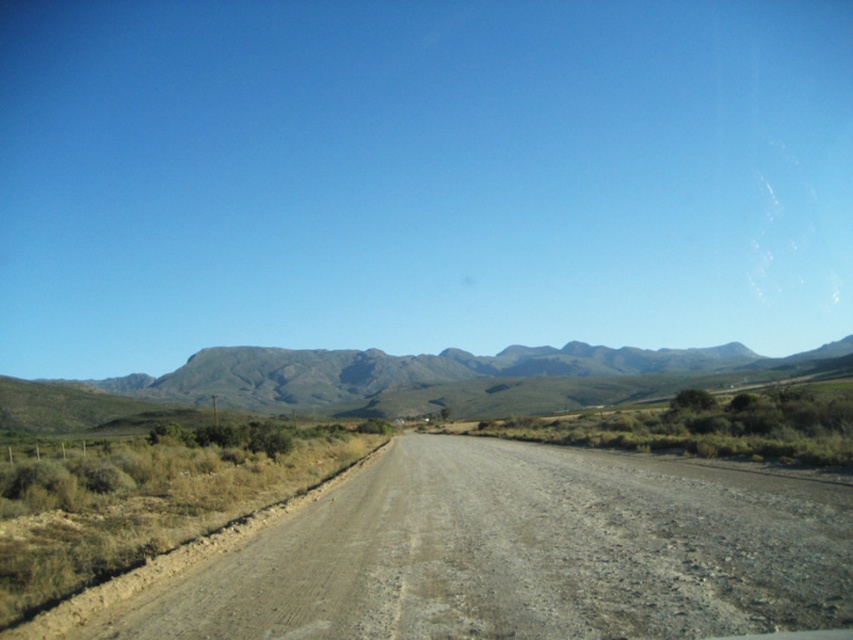
You are standing at the starting point of the dusty gravel road at center and want to reach the gray rocky mountain at center. Which direction should you walk to get closer to the mountain?

You should walk forward along the dusty gravel road at center since it is closer to the viewer than the gray rocky mountain at center, meaning the mountain is further away and the road leads towards it.

You are a hiker planning to traverse the landscape shown in the image. You need to decide which path to take. The dusty gravel road at center is your first option, and the gray rocky mountain at center is your second option. Based on their sizes, which path would be easier to navigate?

The dusty gravel road at center is smaller than the gray rocky mountain at center, so the dusty gravel road at center would be easier to navigate because it requires less effort to traverse compared to the larger and presumably more rugged terrain of the mountain.